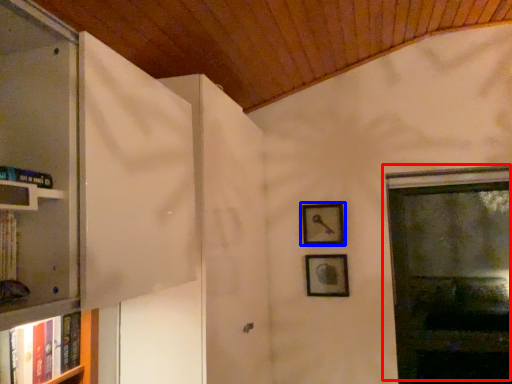
Question: Which object appears farthest to the camera in this image, window (highlighted by a red box) or picture frame (highlighted by a blue box)?

Choices:
 (A) window
 (B) picture frame

Answer: (B)